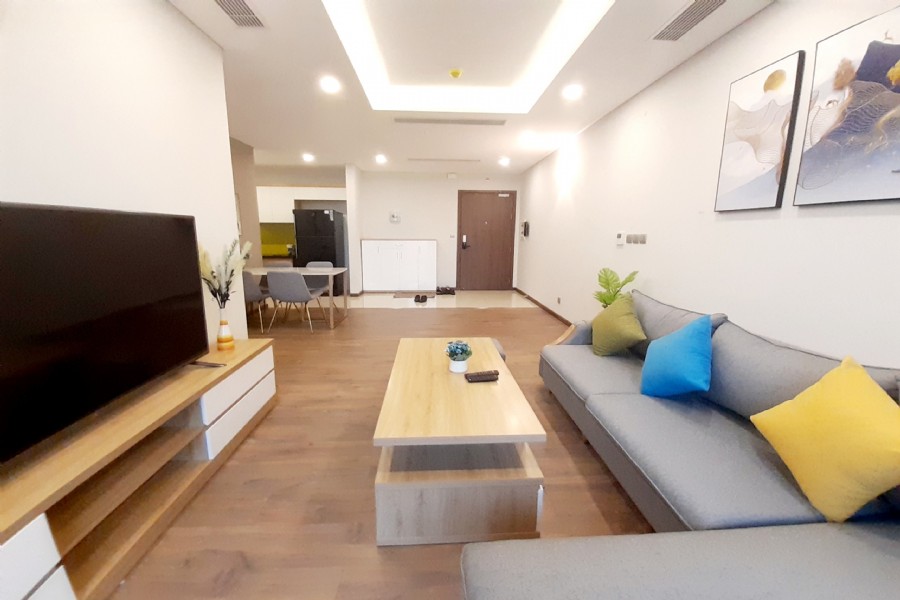
The height and width of the screenshot is (600, 900). Find the location of `back sofa cushion`. back sofa cushion is located at coordinates (658, 321), (750, 366).